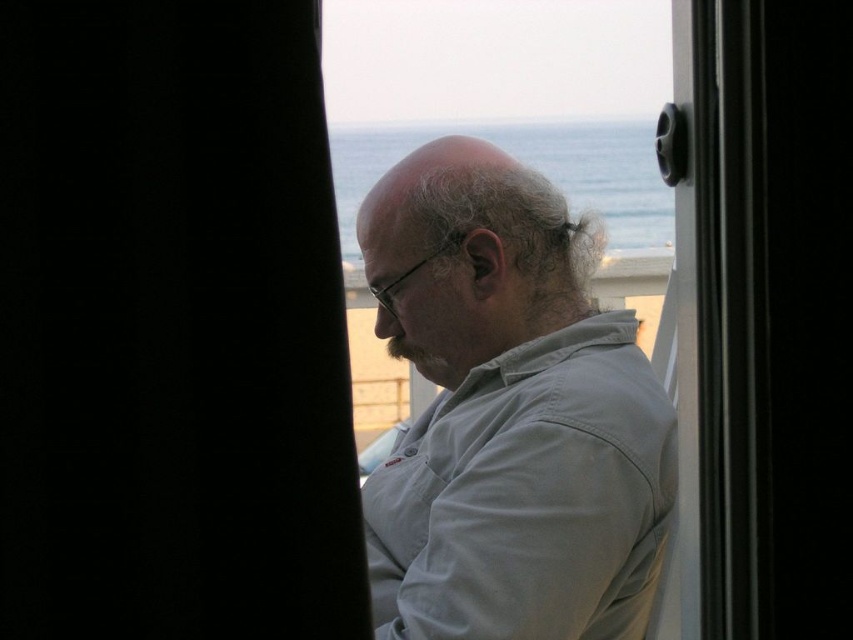
Is point (219, 244) in front of point (444, 513)?

Yes, it is in front of point (444, 513).

This screenshot has height=640, width=853. What do you see at coordinates (171, 326) in the screenshot?
I see `black fabric curtain at left` at bounding box center [171, 326].

What do you see at coordinates (171, 326) in the screenshot? The image size is (853, 640). I see `black fabric curtain at left` at bounding box center [171, 326].

The height and width of the screenshot is (640, 853). I want to click on black fabric curtain at left, so 171,326.